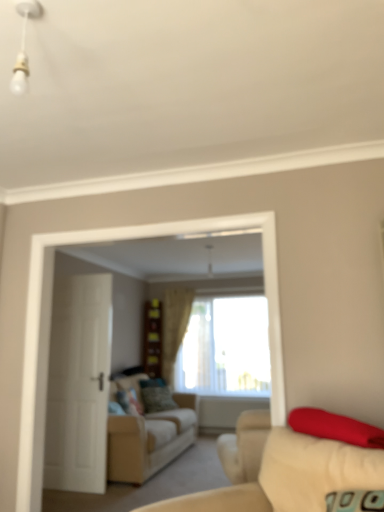
What is the approximate width of beige fabric couch at lower right, the 1th studio couch viewed from the front?

The width of beige fabric couch at lower right, the 1th studio couch viewed from the front, is 1.06 meters.

Measure the distance between point [315,432] and camera.

Point [315,432] and camera are 6.31 feet apart.

The width and height of the screenshot is (384, 512). Find the location of `matte red pillow at right, which ranks as the third pillow in back-to-front order`. matte red pillow at right, which ranks as the third pillow in back-to-front order is located at coordinates (335, 426).

Where is `white glossy bulb at upper left`? This screenshot has width=384, height=512. white glossy bulb at upper left is located at coordinates (24, 45).

Identify the location of beige fabric couch at center, which is counted as the 1th studio couch, starting from the back. The height and width of the screenshot is (512, 384). (149, 440).

Where is `beige fabric couch at lower right, the 1th studio couch viewed from the front`? The width and height of the screenshot is (384, 512). beige fabric couch at lower right, the 1th studio couch viewed from the front is located at coordinates (289, 474).

Who is shorter, beige fabric curtain at center or matte red pillow at right, arranged as the 1th pillow when viewed from the top?

matte red pillow at right, arranged as the 1th pillow when viewed from the top, is shorter.

From a real-world perspective, is beige fabric curtain at center above or below matte red pillow at right, acting as the third pillow starting from the bottom?

From a real-world perspective, beige fabric curtain at center is physically above matte red pillow at right, acting as the third pillow starting from the bottom.

Between beige fabric curtain at center and matte red pillow at right, which ranks as the third pillow in back-to-front order, which one appears on the left side from the viewer's perspective?

Positioned to the left is beige fabric curtain at center.

Is beige fabric curtain at center surrounding matte red pillow at right, acting as the third pillow starting from the bottom?

Actually, matte red pillow at right, acting as the third pillow starting from the bottom, is outside beige fabric curtain at center.

Could you tell me if velvet green pillow at center, which is the second pillow from bottom to top, is facing beige fabric couch at lower right, the 1th studio couch viewed from the front?

No, velvet green pillow at center, which is the second pillow from bottom to top, is not aimed at beige fabric couch at lower right, the 1th studio couch viewed from the front.

What's the angular difference between velvet green pillow at center, placed as the 2th pillow when sorted from top to bottom, and beige fabric couch at lower right, the 1th studio couch viewed from the front,'s facing directions?

The facing directions of velvet green pillow at center, placed as the 2th pillow when sorted from top to bottom, and beige fabric couch at lower right, the 1th studio couch viewed from the front, are 129 degrees apart.

Which is in front, point (136, 404) or point (239, 421)?

Positioned in front is point (239, 421).

Considering the positions of objects velvet green pillow at center, the third pillow in the right-to-left sequence, and beige fabric couch at lower right, arranged as the 1th studio couch when viewed from the top, in the image provided, who is more to the left, velvet green pillow at center, the third pillow in the right-to-left sequence, or beige fabric couch at lower right, arranged as the 1th studio couch when viewed from the top,?

velvet green pillow at center, the third pillow in the right-to-left sequence, is more to the left.

Considering the relative positions of velvet red pillow at center, the third pillow viewed from the top, and beige fabric curtain at center in the image provided, is velvet red pillow at center, the third pillow viewed from the top, to the left of beige fabric curtain at center from the viewer's perspective?

Indeed, velvet red pillow at center, the third pillow viewed from the top, is positioned on the left side of beige fabric curtain at center.

Does point (147, 400) come in front of point (164, 367)?

That is True.

Is velvet red pillow at center, the third pillow viewed from the top, placed right next to beige fabric curtain at center?

No, velvet red pillow at center, the third pillow viewed from the top, is not in contact with beige fabric curtain at center.

Could you tell me if velvet red pillow at center, which is counted as the 1th pillow, starting from the bottom, is turned towards beige fabric curtain at center?

No, velvet red pillow at center, which is counted as the 1th pillow, starting from the bottom, does not turn towards beige fabric curtain at center.

Which of these two, beige fabric couch at lower right, the second studio couch when ordered from bottom to top, or beige fabric couch at center, positioned as the 2th studio couch in front-to-back order, stands taller?

beige fabric couch at center, positioned as the 2th studio couch in front-to-back order.

From a real-world perspective, relative to beige fabric couch at center, which is counted as the 1th studio couch, starting from the back, is beige fabric couch at lower right, arranged as the 1th studio couch when viewed from the top, vertically above or below?

From a real-world perspective, beige fabric couch at lower right, arranged as the 1th studio couch when viewed from the top, is physically above beige fabric couch at center, which is counted as the 1th studio couch, starting from the back.

Between beige fabric couch at lower right, the 1th studio couch viewed from the front, and beige fabric couch at center, which is counted as the 1th studio couch, starting from the back, which one has smaller size?

beige fabric couch at lower right, the 1th studio couch viewed from the front.

Considering their positions, is wooden dresser at center located in front of or behind white glossy bulb at upper left?

In the image, wooden dresser at center appears behind white glossy bulb at upper left.

Is wooden dresser at center not near white glossy bulb at upper left?

Yes, wooden dresser at center and white glossy bulb at upper left are located far from each other.

Does wooden dresser at center have a greater width compared to white glossy bulb at upper left?

Correct, the width of wooden dresser at center exceeds that of white glossy bulb at upper left.

Locate an element on the screen. This screenshot has height=512, width=384. dresser located above the beige fabric couch at lower right, the second studio couch positioned from the back (from a real-world perspective) is located at coordinates (153, 338).

Is wooden dresser at center at the back of beige fabric couch at lower right, the second studio couch positioned from the back?

beige fabric couch at lower right, the second studio couch positioned from the back, does not have its back to wooden dresser at center.

Is beige fabric couch at lower right, the second studio couch positioned from the back, smaller than wooden dresser at center?

Incorrect, beige fabric couch at lower right, the second studio couch positioned from the back, is not smaller in size than wooden dresser at center.

From the image's perspective, is white glossy bulb at upper left below matte red pillow at right, acting as the third pillow starting from the bottom?

No.

Considering the positions of objects white glossy bulb at upper left and matte red pillow at right, placed as the 1th pillow when sorted from right to left, in the image provided, who is behind, white glossy bulb at upper left or matte red pillow at right, placed as the 1th pillow when sorted from right to left,?

matte red pillow at right, placed as the 1th pillow when sorted from right to left.

Considering the relative sizes of white glossy bulb at upper left and matte red pillow at right, acting as the third pillow starting from the bottom, in the image provided, is white glossy bulb at upper left taller than matte red pillow at right, acting as the third pillow starting from the bottom,?

Yes.

Is the surface of white glossy bulb at upper left in direct contact with matte red pillow at right, arranged as the third pillow when viewed from the left?

No, white glossy bulb at upper left is not beside matte red pillow at right, arranged as the third pillow when viewed from the left.

Image resolution: width=384 pixels, height=512 pixels. In the image, there is a matte red pillow at right, placed as the 1th pillow when sorted from right to left. In order to click on curtain below it (from the image's perspective) in this screenshot , I will do `click(174, 327)`.

What are the coordinates of `studio couch above the velvet green pillow at center, which is the second pillow from front to back (from the image's perspective)` in the screenshot? It's located at (289, 474).

Based on their spatial positions, is beige fabric couch at lower right, the 1th studio couch viewed from the front, or white glossy bulb at upper left closer to beige fabric couch at center, positioned as the 2th studio couch in front-to-back order?

beige fabric couch at lower right, the 1th studio couch viewed from the front, is positioned closer to the anchor beige fabric couch at center, positioned as the 2th studio couch in front-to-back order.

When comparing their distances from beige fabric couch at lower right, arranged as the 1th studio couch when viewed from the top, does beige fabric curtain at center or white glossy bulb at upper left seem closer?

white glossy bulb at upper left is closer to beige fabric couch at lower right, arranged as the 1th studio couch when viewed from the top.

Estimate the real-world distances between objects in this image. Which object is closer to white matte door at left, beige fabric curtain at center or matte red pillow at right, placed as the 1th pillow when sorted from right to left?

The object closer to white matte door at left is matte red pillow at right, placed as the 1th pillow when sorted from right to left.

From the image, which object appears to be farther from velvet green pillow at center, placed as the 2th pillow when sorted from top to bottom, white glossy bulb at upper left or white matte door at left?

white glossy bulb at upper left is positioned further to the anchor velvet green pillow at center, placed as the 2th pillow when sorted from top to bottom.

From the picture: Considering their positions, is white glossy bulb at upper left positioned further to beige fabric couch at lower right, the 1th studio couch viewed from the front, than wooden dresser at center?

wooden dresser at center is further to beige fabric couch at lower right, the 1th studio couch viewed from the front.

Estimate the real-world distances between objects in this image. Which object is closer to matte red pillow at right, arranged as the 1th pillow when viewed from the top, beige fabric couch at center, positioned as the 2th studio couch in front-to-back order, or velvet red pillow at center, placed as the 1th pillow when sorted from back to front?

Based on the image, beige fabric couch at center, positioned as the 2th studio couch in front-to-back order, appears to be nearer to matte red pillow at right, arranged as the 1th pillow when viewed from the top.

Looking at the image, which one is located further to beige fabric couch at lower right, the second studio couch when ordered from bottom to top, beige fabric curtain at center or velvet red pillow at center, placed as the 1th pillow when sorted from back to front?

beige fabric curtain at center.

From the image, which object appears to be farther from matte red pillow at right, arranged as the 1th pillow when viewed from the top, beige fabric curtain at center or white matte door at left?

beige fabric curtain at center is further to matte red pillow at right, arranged as the 1th pillow when viewed from the top.

Locate an element on the screen. Image resolution: width=384 pixels, height=512 pixels. studio couch between matte red pillow at right, arranged as the third pillow when viewed from the left, and velvet red pillow at center, the third pillow viewed from the top, in the front-back direction is located at coordinates (149, 440).

Locate an element on the screen. This screenshot has width=384, height=512. studio couch positioned between white matte door at left and velvet red pillow at center, the third pillow viewed from the top, from near to far is located at coordinates (149, 440).

Find the location of a particular element. The height and width of the screenshot is (512, 384). pillow between beige fabric couch at lower right, the second studio couch when ordered from bottom to top, and white matte door at left, along the z-axis is located at coordinates (335, 426).

This screenshot has height=512, width=384. I want to click on studio couch located between matte red pillow at right, which ranks as the third pillow in back-to-front order, and velvet green pillow at center, placed as the 2th pillow when sorted from top to bottom, in the depth direction, so click(149, 440).